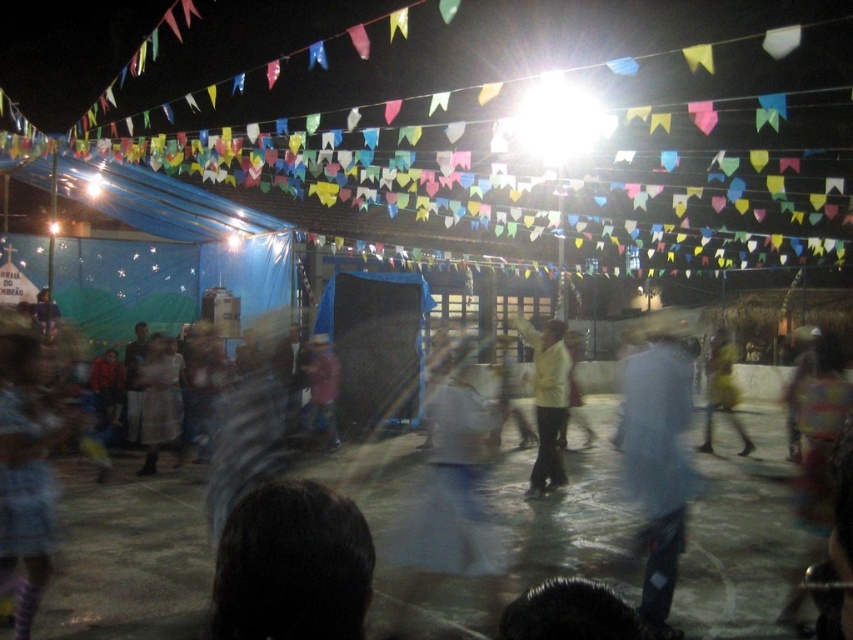
You are at the event and want to take a photo of the white matte shirt at center and the yellow fabric at center. Which object is wider when you frame them in your camera?

The yellow fabric at center is wider than the white matte shirt at center, so it will appear wider in the photo.

You are standing at the point labeled point at (320, 428). You want to walk to the entrance of the event, which is located 12.28 meters away from your current position. The path to the entrance is straight and unobstructed. If you walk at a constant speed of 1.5 meters per second, how many seconds will it take you to reach the entrance?

The distance to the entrance is 12.28 meters, and walking at 1.5 meters per second, the time required is 12.28 divided by 1.5, which equals approximately 8.19 seconds. So it will take about 8.19 seconds to reach the entrance.